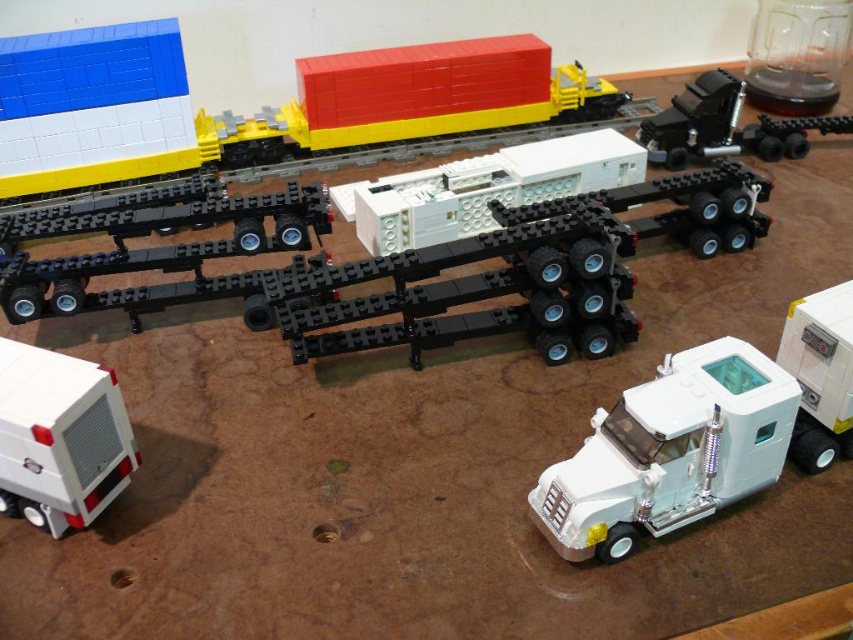
Question: Is black rubber truck trailer at center positioned in front of white matte trailer truck at center?

Choices:
 (A) yes
 (B) no

Answer: (A)

Question: Can you confirm if black rubber truck trailer at center is positioned to the left of white matte truck at lower right?

Choices:
 (A) yes
 (B) no

Answer: (A)

Question: Which point is closer to the camera?

Choices:
 (A) black rubber truck trailer at center
 (B) white matte truck at lower left

Answer: (B)

Question: Which of these objects is positioned farthest from the black rubber truck at upper right?

Choices:
 (A) white matte trailer at center
 (B) white matte truck at lower right
 (C) black rubber truck trailer at center
 (D) white matte truck at lower left

Answer: (D)

Question: Which object is positioned farthest from the white matte truck at lower right?

Choices:
 (A) white matte truck at lower left
 (B) white plastic trailer truck at lower right
 (C) black rubber truck trailer at center

Answer: (A)

Question: Does white plastic trailer truck at lower right have a lesser width compared to black rubber truck trailer at center?

Choices:
 (A) yes
 (B) no

Answer: (A)